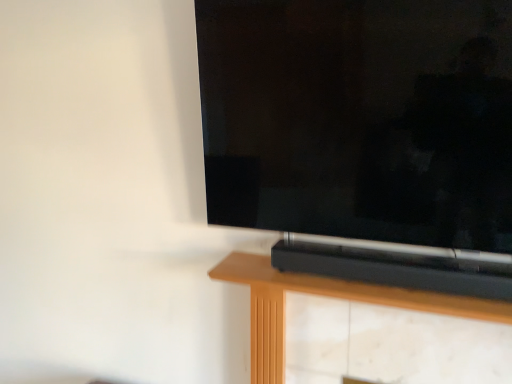
Where is `free point above black plastic soundbar at center (from a real-world perspective)`? This screenshot has width=512, height=384. free point above black plastic soundbar at center (from a real-world perspective) is located at coordinates [x=328, y=270].